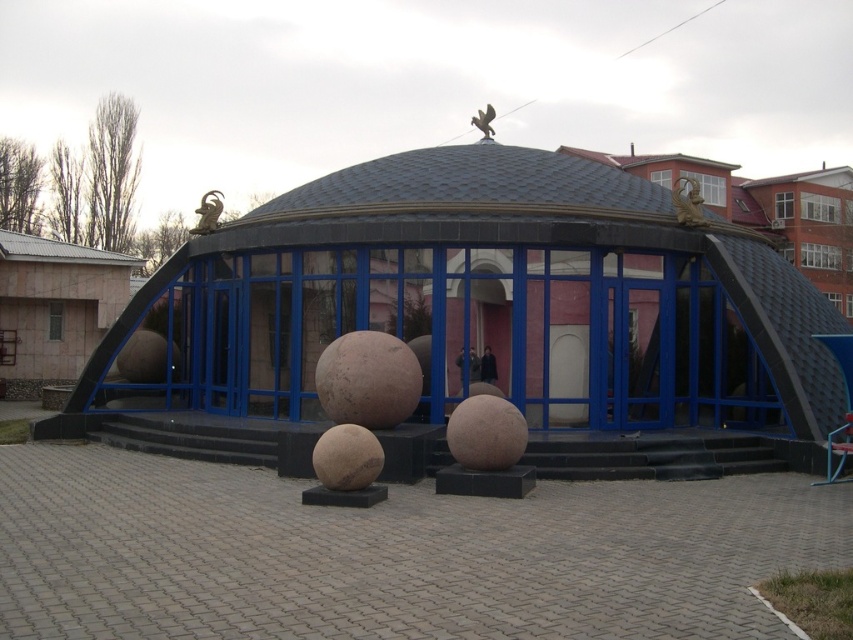
Question: In this image, where is glossy metallic dome at center located relative to metallic eagle at upper center?

Choices:
 (A) above
 (B) below

Answer: (B)

Question: Can you confirm if glossy metallic dome at center is positioned to the left of gold metallic ram at upper center?

Choices:
 (A) no
 (B) yes

Answer: (A)

Question: Estimate the real-world distances between objects in this image. Which object is closer to the gold metallic ram at upper center?

Choices:
 (A) gold metallic dragon at upper right
 (B) glossy metallic dome at center

Answer: (B)

Question: Considering the real-world distances, which object is closest to the gold metallic dragon at upper right?

Choices:
 (A) metallic eagle at upper center
 (B) glossy metallic dome at center
 (C) gold metallic ram at upper center

Answer: (B)

Question: Considering the relative positions of glossy metallic dome at center and gold metallic dragon at upper right in the image provided, where is glossy metallic dome at center located with respect to gold metallic dragon at upper right?

Choices:
 (A) left
 (B) right

Answer: (A)

Question: Considering the real-world distances, which object is farthest from the metallic eagle at upper center?

Choices:
 (A) glossy metallic dome at center
 (B) gold metallic dragon at upper right
 (C) gold metallic ram at upper center

Answer: (B)